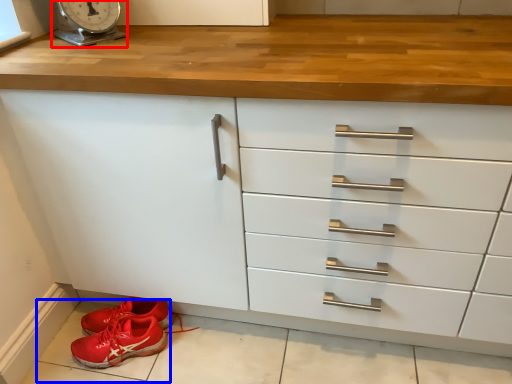
Question: Which object appears closest to the camera in this image, scale (highlighted by a red box) or tile (highlighted by a blue box)?

Choices:
 (A) scale
 (B) tile

Answer: (A)